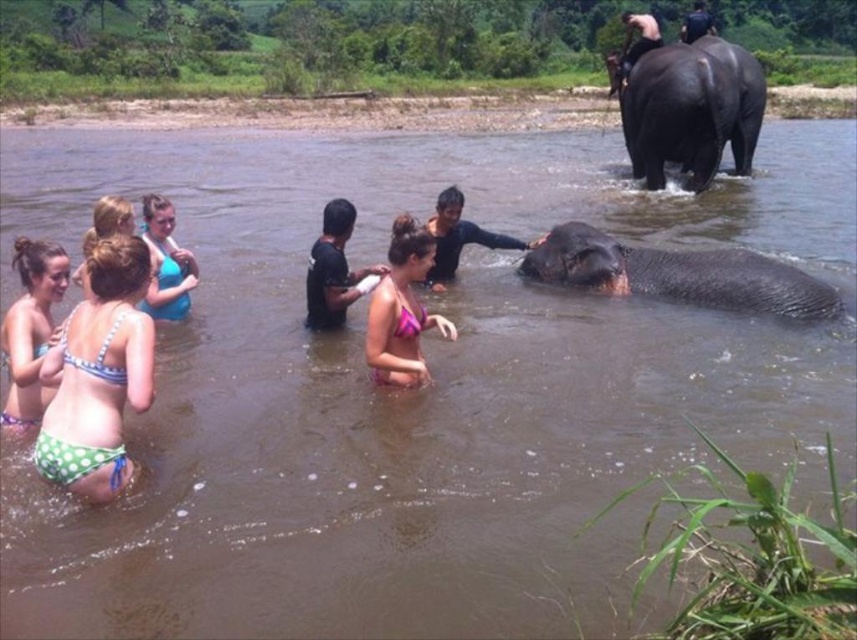
Does point (31, 273) come behind point (615, 83)?

No, (31, 273) is in front of (615, 83).

Does polka dot bikini at left have a greater width compared to smooth black elephant at upper right?

No.

Is point (15, 314) in front of point (644, 45)?

That is True.

The image size is (857, 640). I want to click on polka dot bikini at left, so click(x=30, y=328).

Is point (442, 221) positioned after point (697, 1)?

No, it is not.

Looking at this image, is dark brown skin at center to the left of black matte shirt at upper center from the viewer's perspective?

Correct, you'll find dark brown skin at center to the left of black matte shirt at upper center.

Image resolution: width=857 pixels, height=640 pixels. In order to click on dark brown skin at center in this screenshot , I will do `click(459, 237)`.

Image resolution: width=857 pixels, height=640 pixels. I want to click on dark brown skin at center, so click(x=459, y=237).

Is pink bikini at center shorter than polka dot bikini at left?

Incorrect, pink bikini at center's height does not fall short of polka dot bikini at left's.

Identify the location of pink bikini at center. Image resolution: width=857 pixels, height=640 pixels. (402, 308).

This screenshot has height=640, width=857. Identify the location of pink bikini at center. (402, 308).